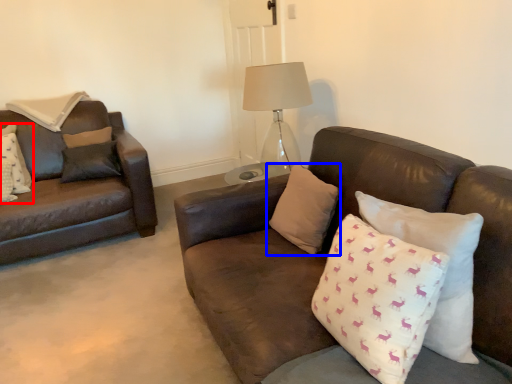
Question: Which object appears farthest to the camera in this image, pillow (highlighted by a red box) or pillow (highlighted by a blue box)?

Choices:
 (A) pillow
 (B) pillow

Answer: (A)